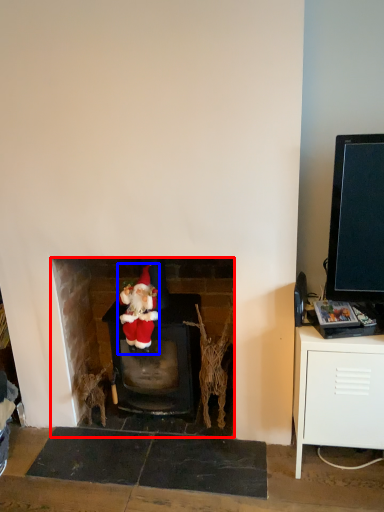
Question: Which object is closer to the camera taking this photo, fireplace (highlighted by a red box) or person (highlighted by a blue box)?

Choices:
 (A) fireplace
 (B) person

Answer: (B)